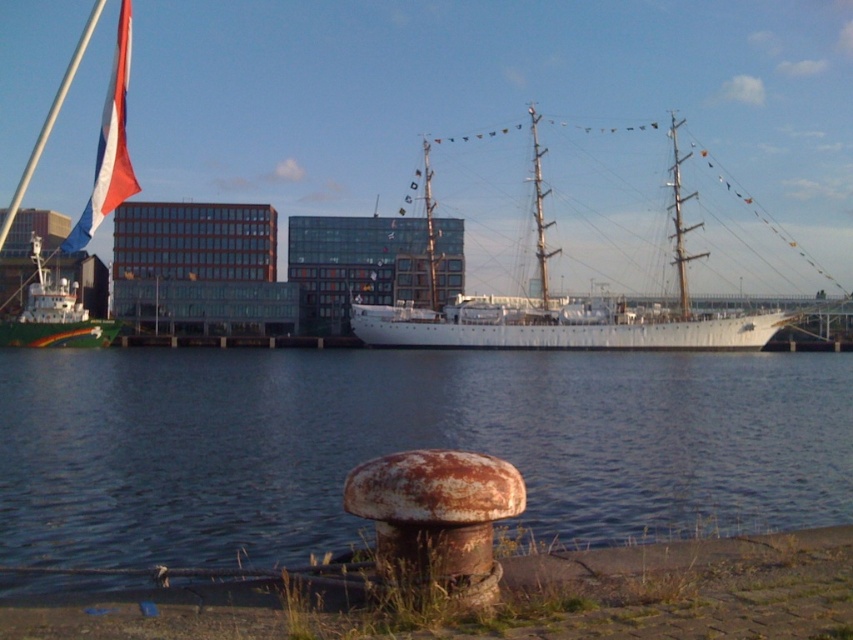
Consider the image. You are standing at the edge of the harbor and see the rusty metallic water at lower center and the white glossy ship at left. Which object is nearer to you?

The rusty metallic water at lower center is closer to the viewer than the white glossy ship at left, so the rusty metallic water at lower center is nearer to you.